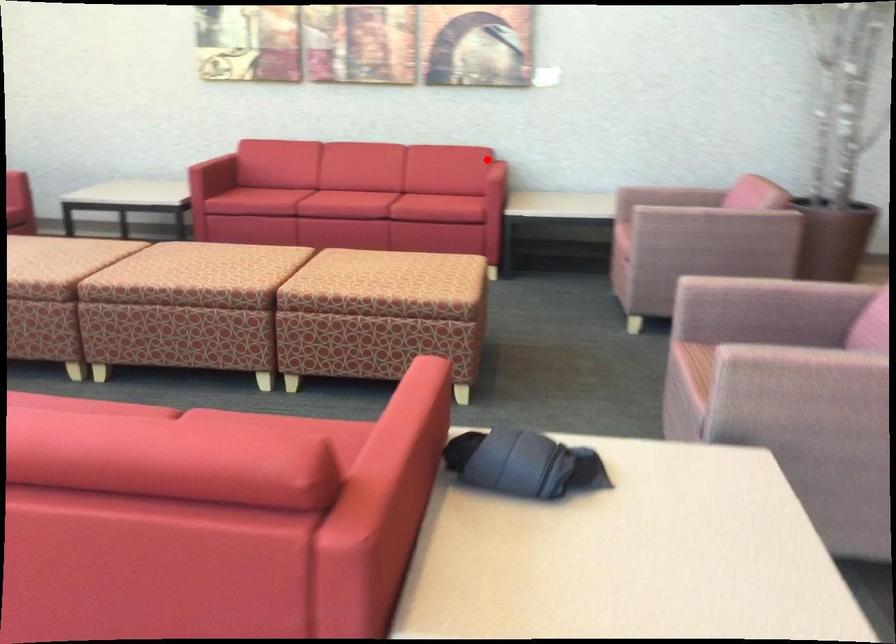
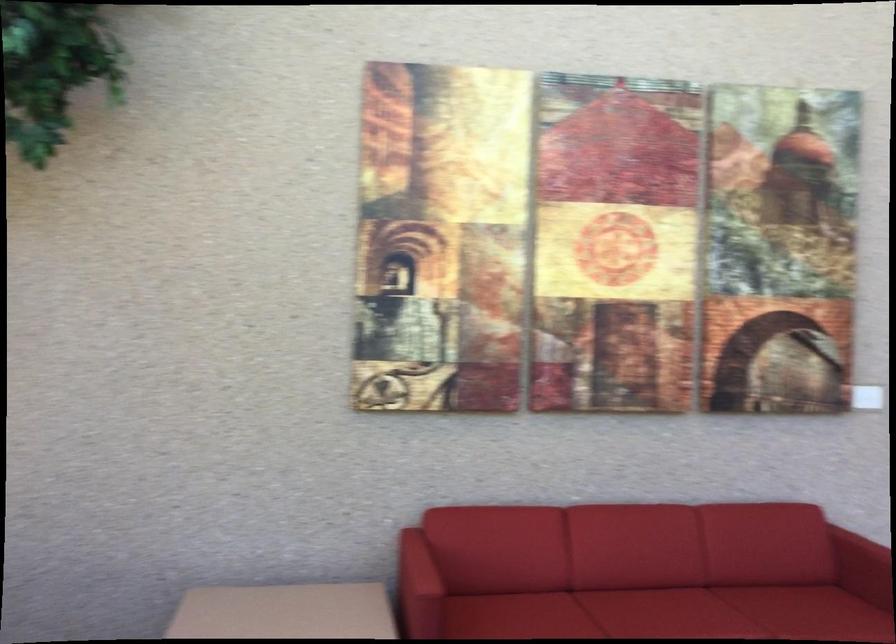
The point at the highlighted location is marked in the first image. Where is the corresponding point in the second image?

(864, 558)